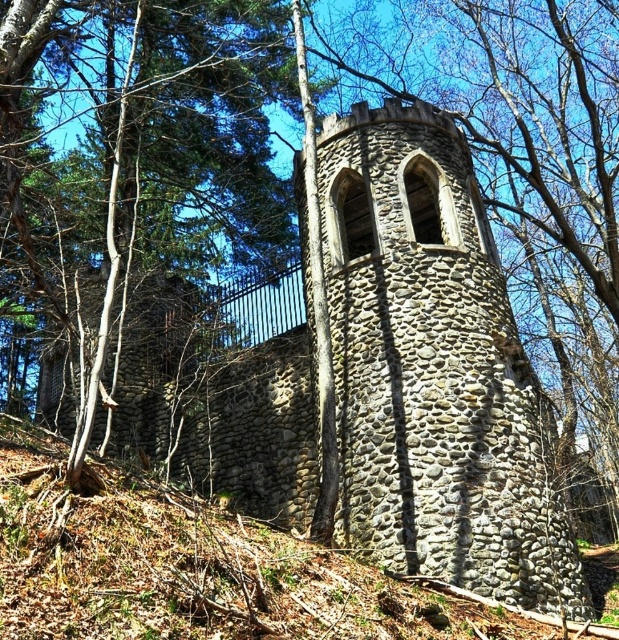
You are an architect examining the stone tower at center and the gray stone wall at center in the image. Which structure is built on top of the other?

The stone tower at center is positioned over the gray stone wall at center, meaning the tower is built on top of the gray stone wall at center.

You are standing in the wooded area around the stone tower. If you walk directly toward the point marked by point (433,369), which object will you be approaching?

The point (433,369) marks the stone tower at center, so walking toward it will lead you directly to the stone tower at center.